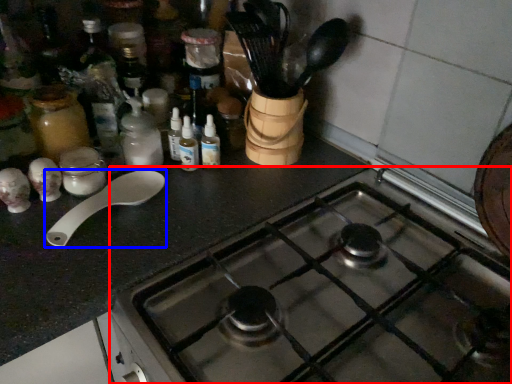
Question: Which object appears closest to the camera in this image, gas stove (highlighted by a red box) or spoon (highlighted by a blue box)?

Choices:
 (A) gas stove
 (B) spoon

Answer: (A)